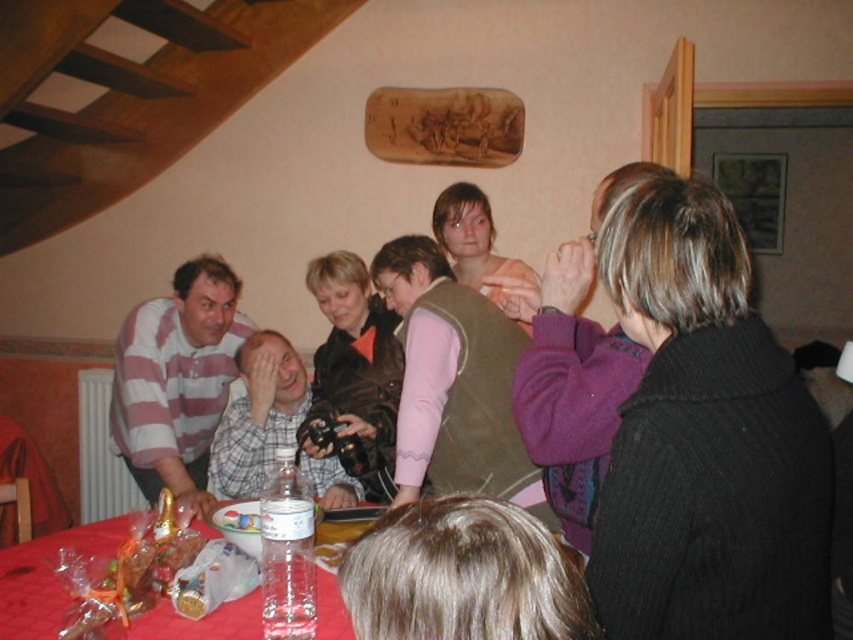
Is black knitted sweater at upper right positioned in front of striped cotton shirt at left?

Yes, black knitted sweater at upper right is closer to the viewer.

Does black knitted sweater at upper right have a greater height compared to striped cotton shirt at left?

Incorrect, black knitted sweater at upper right's height is not larger of striped cotton shirt at left's.

Is point (827, 547) more distant than point (184, 416)?

No.

Identify the location of black knitted sweater at upper right. Image resolution: width=853 pixels, height=640 pixels. [x=705, y=440].

Between black knitted sweater at upper right and translucent plastic table at lower center, which one appears on the right side from the viewer's perspective?

black knitted sweater at upper right is more to the right.

Locate an element on the screen. This screenshot has height=640, width=853. black knitted sweater at upper right is located at coordinates pyautogui.click(x=705, y=440).

Which is more to the right, matte black camera at center or striped cotton shirt at left?

matte black camera at center

Can you confirm if matte black camera at center is smaller than striped cotton shirt at left?

Yes.

Identify the location of matte black camera at center. (701, 435).

You are a GUI agent. You are given a task and a screenshot of the screen. Output one action in this format:
    pyautogui.click(x=<x>, y=<y>)
    Task: Click on the matte black camera at center
    This screenshot has height=640, width=853.
    Given the screenshot: What is the action you would take?
    pyautogui.click(x=701, y=435)